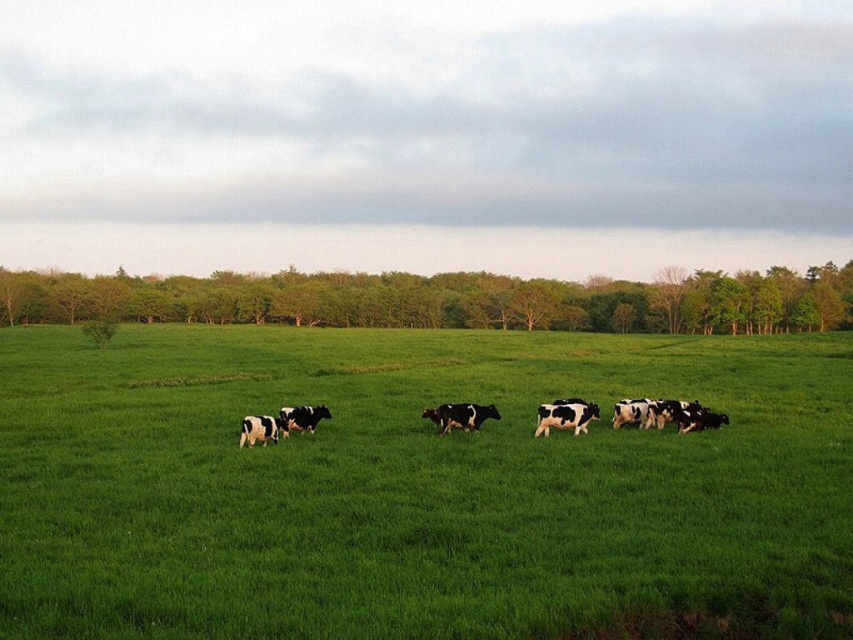
Question: Which object is positioned closest to the green grass pasture at center?

Choices:
 (A) black and white spotted cows at center
 (B) green leafy trees at upper center

Answer: (A)

Question: Is green grass pasture at center smaller than black and white spotted cows at center?

Choices:
 (A) no
 (B) yes

Answer: (A)

Question: Is green grass pasture at center to the left of green leafy trees at upper center from the viewer's perspective?

Choices:
 (A) yes
 (B) no

Answer: (A)

Question: Does green leafy trees at upper center have a smaller size compared to black and white spotted cows at center?

Choices:
 (A) yes
 (B) no

Answer: (B)

Question: Which object appears farthest from the camera in this image?

Choices:
 (A) black and white spotted cows at center
 (B) green leafy trees at upper center

Answer: (B)

Question: Which of the following is the farthest from the observer?

Choices:
 (A) (703, 420)
 (B) (252, 282)
 (C) (28, 381)

Answer: (B)